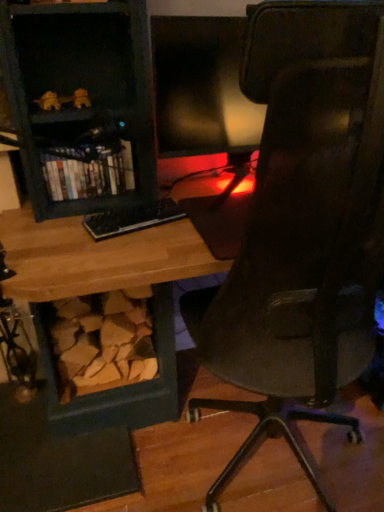
This screenshot has width=384, height=512. What do you see at coordinates (132, 218) in the screenshot? I see `black plastic keyboard at center` at bounding box center [132, 218].

Where is `matte black monitor at center`? Image resolution: width=384 pixels, height=512 pixels. matte black monitor at center is located at coordinates (202, 89).

You are a GUI agent. You are given a task and a screenshot of the screen. Output one action in this format:
    pyautogui.click(x=<x>, y=<y>)
    Task: Click on the keyboard located below the matte black monitor at center (from the image's perspective)
    
    Given the screenshot: What is the action you would take?
    pyautogui.click(x=132, y=218)

Considering the sizes of objects matte black monitor at center and black plastic keyboard at center in the image provided, who is taller, matte black monitor at center or black plastic keyboard at center?

With more height is matte black monitor at center.

From the picture: Considering the sizes of objects black plastic keyboard at center and matte black bookshelf at left in the image provided, who is taller, black plastic keyboard at center or matte black bookshelf at left?

Standing taller between the two is matte black bookshelf at left.

Is black plastic keyboard at center situated inside matte black bookshelf at left or outside?

black plastic keyboard at center is not enclosed by matte black bookshelf at left.

From the image's perspective, is black plastic keyboard at center beneath matte black bookshelf at left?

Indeed, from the image's perspective, black plastic keyboard at center is shown beneath matte black bookshelf at left.

Is black plastic keyboard at center turned away from matte black bookshelf at left?

That's right, black plastic keyboard at center is facing away from matte black bookshelf at left.

Which is closer, (231, 83) or (106, 173)?

The point (231, 83) is in front.

Who is bigger, matte black monitor at center or matte black bookshelf at left?

Bigger between the two is matte black monitor at center.

Based on the photo, does matte black monitor at center have a lesser height compared to matte black bookshelf at left?

No.

From a real-world perspective, is matte black monitor at center over matte black bookshelf at left?

Correct, in the physical world, matte black monitor at center is higher than matte black bookshelf at left.

Is matte black bookshelf at left positioned beyond the bounds of matte black monitor at center?

That's correct, matte black bookshelf at left is outside of matte black monitor at center.

Is matte black bookshelf at left facing away from matte black monitor at center?

No, matte black bookshelf at left is not facing away from matte black monitor at center.

Can you confirm if matte black bookshelf at left is thinner than matte black monitor at center?

No.

Is point (124, 147) farther from viewer compared to point (254, 106)?

Yes, point (124, 147) is farther from viewer.

Is black plastic keyboard at center inside the boundaries of matte black monitor at center, or outside?

black plastic keyboard at center is not inside matte black monitor at center, it's outside.

The height and width of the screenshot is (512, 384). Find the location of `computer monitor located above the black plastic keyboard at center (from the image's perspective)`. computer monitor located above the black plastic keyboard at center (from the image's perspective) is located at coordinates (202, 89).

From a real-world perspective, which is physically below, black plastic keyboard at center or matte black monitor at center?

In real-world perspective, black plastic keyboard at center is lower.

Is black plastic keyboard at center facing away from matte black monitor at center?

No, black plastic keyboard at center is not facing away from matte black monitor at center.

Which is in front, matte black bookshelf at left or black plastic keyboard at center?

black plastic keyboard at center.

Looking at the image, does matte black bookshelf at left seem bigger or smaller compared to black plastic keyboard at center?

matte black bookshelf at left is bigger than black plastic keyboard at center.

You are a GUI agent. You are given a task and a screenshot of the screen. Output one action in this format:
    pyautogui.click(x=<x>, y=<y>)
    Task: Click on the book behind the black plastic keyboard at center
    The width and height of the screenshot is (384, 512).
    Given the screenshot: What is the action you would take?
    pyautogui.click(x=88, y=172)

This screenshot has height=512, width=384. I want to click on computer monitor that appears in front of the black plastic keyboard at center, so click(202, 89).

Where is `keyboard on the right of matte black bookshelf at left`? keyboard on the right of matte black bookshelf at left is located at coordinates (132, 218).

Looking at the image, which one is located further to matte black monitor at center, black plastic keyboard at center or matte black bookshelf at left?

Among the two, black plastic keyboard at center is located further to matte black monitor at center.

Considering their positions, is matte black monitor at center positioned further to matte black bookshelf at left than black plastic keyboard at center?

matte black monitor at center is further to matte black bookshelf at left.

Based on their spatial positions, is matte black monitor at center or matte black bookshelf at left closer to black plastic keyboard at center?

matte black bookshelf at left is closer to black plastic keyboard at center.

Based on their spatial positions, is matte black bookshelf at left or black plastic keyboard at center closer to matte black monitor at center?

Based on the image, matte black bookshelf at left appears to be nearer to matte black monitor at center.

From the picture: Estimate the real-world distances between objects in this image. Which object is closer to black plastic keyboard at center, matte black bookshelf at left or matte black monitor at center?

matte black bookshelf at left is closer to black plastic keyboard at center.

When comparing their distances from matte black bookshelf at left, does black plastic keyboard at center or matte black monitor at center seem further?

matte black monitor at center is positioned further to the anchor matte black bookshelf at left.

The width and height of the screenshot is (384, 512). What are the coordinates of `keyboard between matte black bookshelf at left and matte black monitor at center in the horizontal direction` in the screenshot? It's located at pyautogui.click(x=132, y=218).